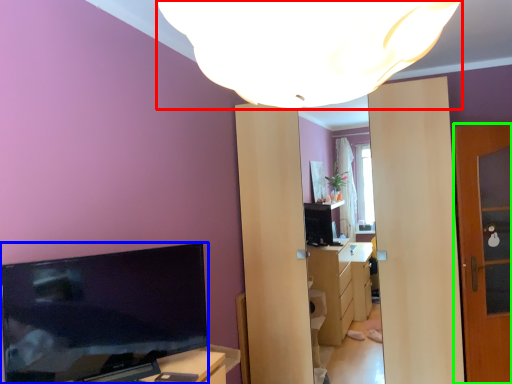
Question: Estimate the real-world distances between objects in this image. Which object is closer to lamp (highlighted by a red box), television (highlighted by a blue box) or door (highlighted by a green box)?

Choices:
 (A) television
 (B) door

Answer: (A)